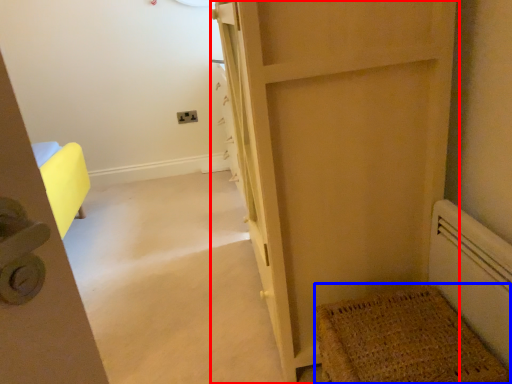
Question: Which object is further to the camera taking this photo, door (highlighted by a red box) or doormat (highlighted by a blue box)?

Choices:
 (A) door
 (B) doormat

Answer: (B)